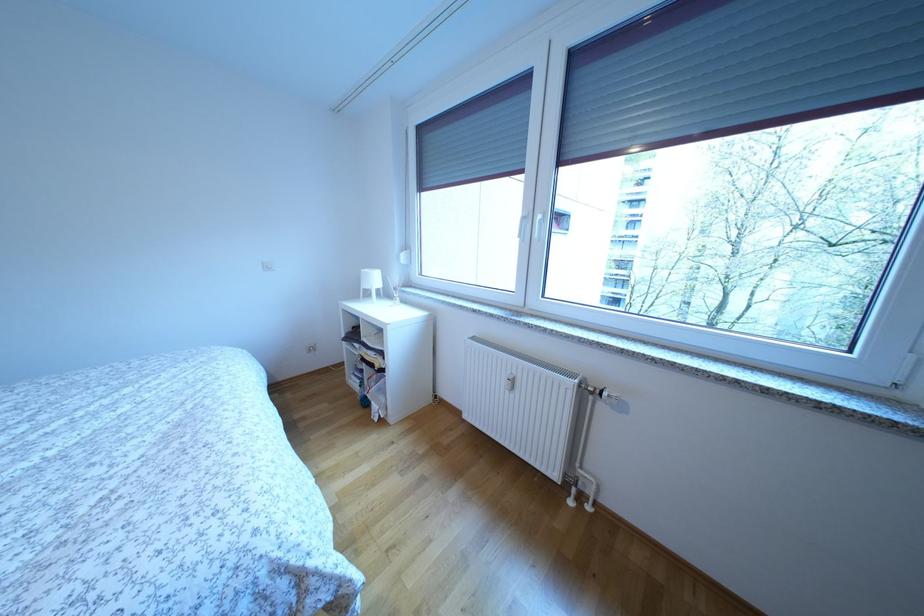
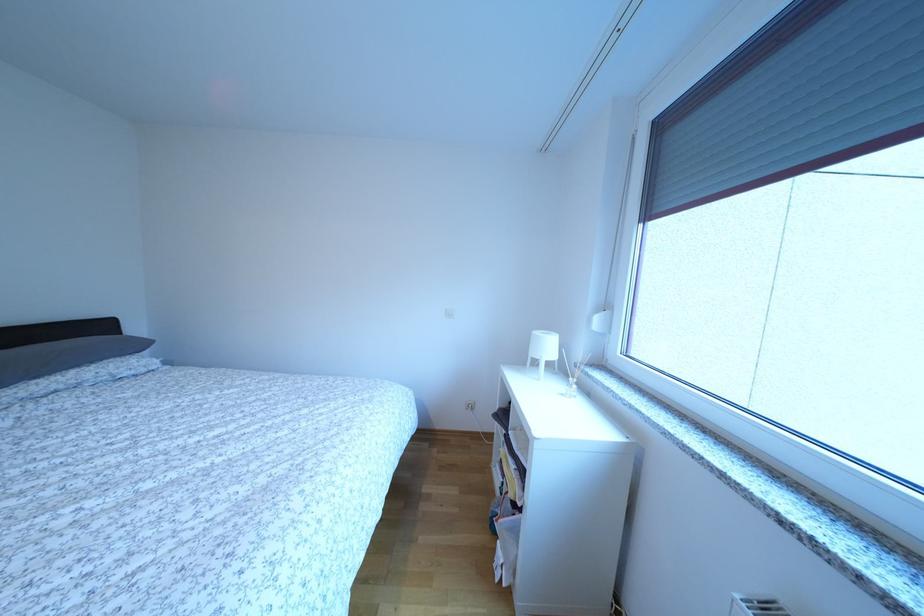
Question: The first image is from the beginning of the video and the second image is from the end. How did the camera likely rotate when shooting the video?

Choices:
 (A) Left
 (B) Right
 (C) Up
 (D) Down

Answer: (A)